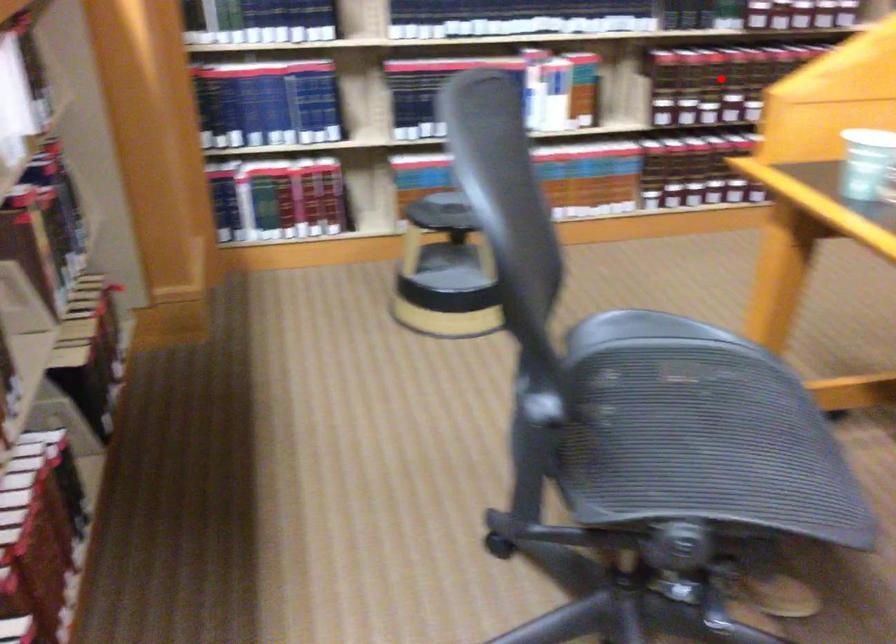
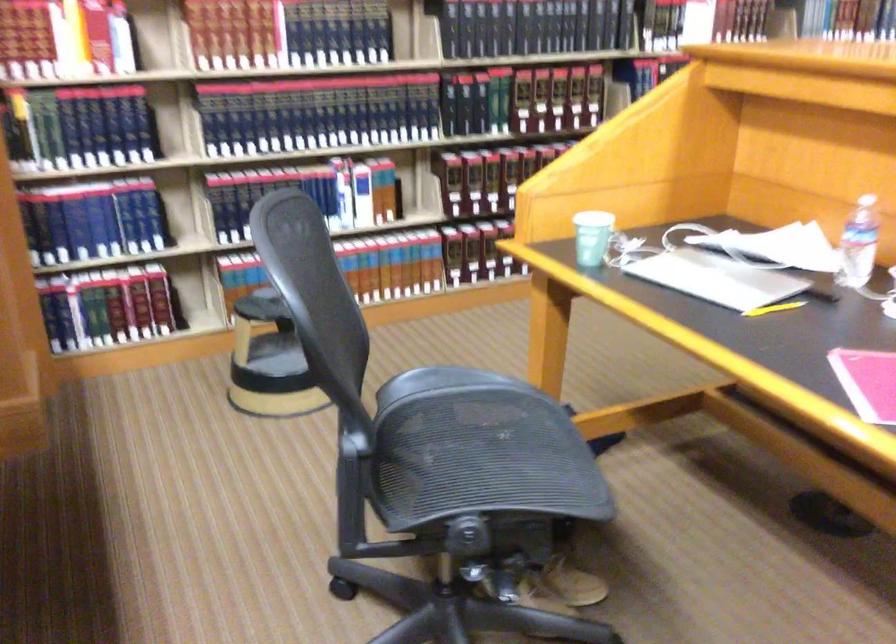
Find the pixel in the second image that matches the highlighted location in the first image.

(488, 176)